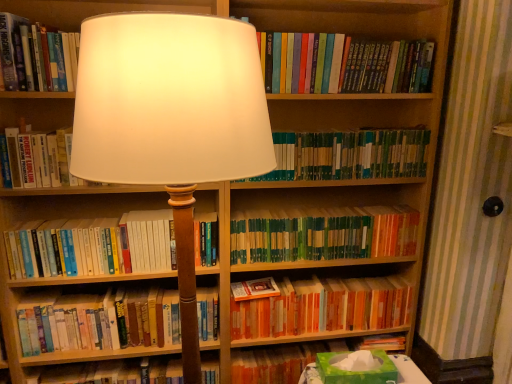
Question: Is hardcover book at center, the 8th book viewed from the top, surrounding hardcover books at upper center, acting as the 8th book starting from the bottom?

Choices:
 (A) no
 (B) yes

Answer: (A)

Question: Is hardcover book at center, the 1th book when ordered from bottom to top, positioned before hardcover books at upper center, acting as the first book starting from the top?

Choices:
 (A) no
 (B) yes

Answer: (A)

Question: Considering the relative positions of hardcover book at center, the 1th book when ordered from bottom to top, and hardcover books at upper center, acting as the first book starting from the top, in the image provided, is hardcover book at center, the 1th book when ordered from bottom to top, behind hardcover books at upper center, acting as the first book starting from the top,?

Choices:
 (A) no
 (B) yes

Answer: (B)

Question: Is hardcover book at center, the 1th book when ordered from bottom to top, at the right side of hardcover books at upper center, acting as the first book starting from the top?

Choices:
 (A) no
 (B) yes

Answer: (A)

Question: From a real-world perspective, is hardcover book at center, the 1th book when ordered from bottom to top, over hardcover books at upper center, acting as the first book starting from the top?

Choices:
 (A) no
 (B) yes

Answer: (A)

Question: Is there a large distance between hardcover book at center, the 8th book viewed from the top, and hardcover books at upper center, acting as the first book starting from the top?

Choices:
 (A) yes
 (B) no

Answer: (A)

Question: Is hardcover book at center, the 8th book viewed from the top, located within hardcover books at upper center, acting as the 8th book starting from the bottom?

Choices:
 (A) yes
 (B) no

Answer: (B)

Question: Does hardcover books at upper center, acting as the first book starting from the top, have a lesser width compared to hardcover book at center, the 8th book viewed from the top?

Choices:
 (A) no
 (B) yes

Answer: (B)

Question: Is the depth of hardcover books at upper center, acting as the first book starting from the top, less than that of hardcover book at center, the 8th book viewed from the top?

Choices:
 (A) no
 (B) yes

Answer: (B)

Question: Would you say hardcover books at upper center, acting as the first book starting from the top, is outside hardcover book at center, the 1th book when ordered from bottom to top?

Choices:
 (A) yes
 (B) no

Answer: (A)

Question: Is hardcover books at upper center, acting as the first book starting from the top, bigger than hardcover book at center, the 8th book viewed from the top?

Choices:
 (A) no
 (B) yes

Answer: (A)

Question: From a real-world perspective, is hardcover books at upper center, acting as the first book starting from the top, under hardcover book at center, the 8th book viewed from the top?

Choices:
 (A) no
 (B) yes

Answer: (A)

Question: Can you confirm if matte white lampshade at center is smaller than green matte bookshelf at center, the fifth book when ordered from top to bottom?

Choices:
 (A) yes
 (B) no

Answer: (B)